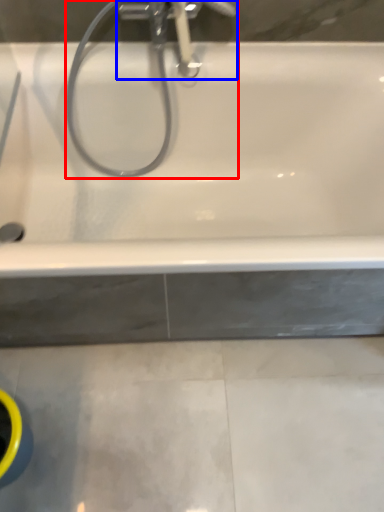
Question: Which of the following is the closest to the observer, plumbing fixture (highlighted by a red box) or tap (highlighted by a blue box)?

Choices:
 (A) plumbing fixture
 (B) tap

Answer: (A)